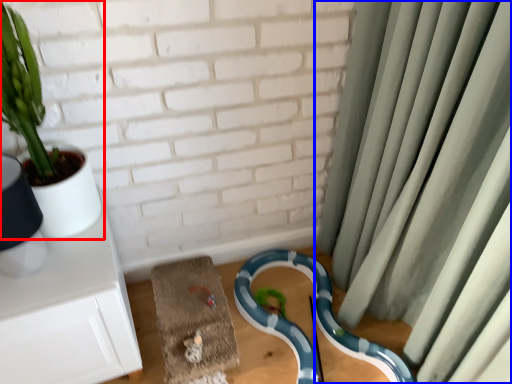
Question: Which object appears farthest to the camera in this image, houseplant (highlighted by a red box) or curtain (highlighted by a blue box)?

Choices:
 (A) houseplant
 (B) curtain

Answer: (A)